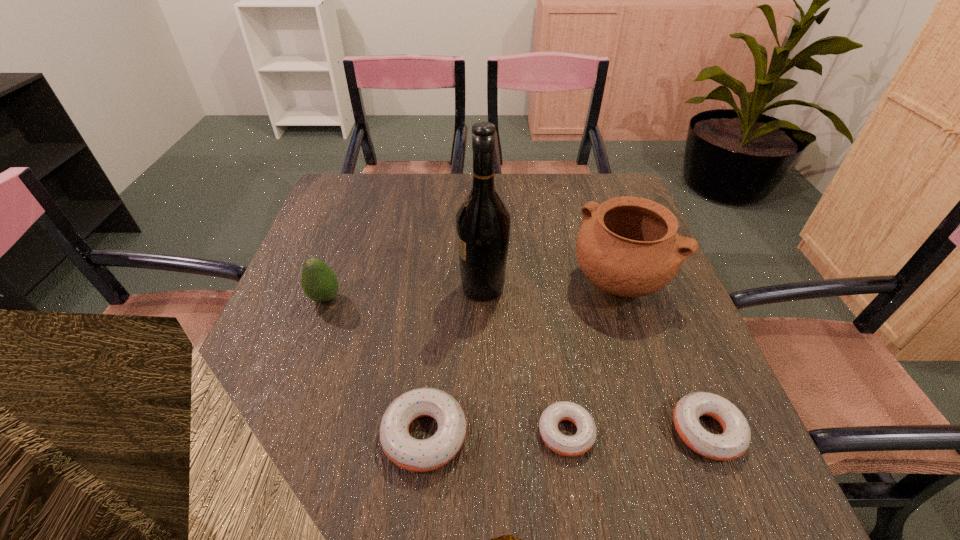
Please point a spot on the left to add another doughnut. Please provide its 2D coordinates. Your answer should be formatted as a tuple, i.e. [(x, y)], where the tuple contains the x and y coordinates of a point satisfying the conditions above.

[(282, 437)]